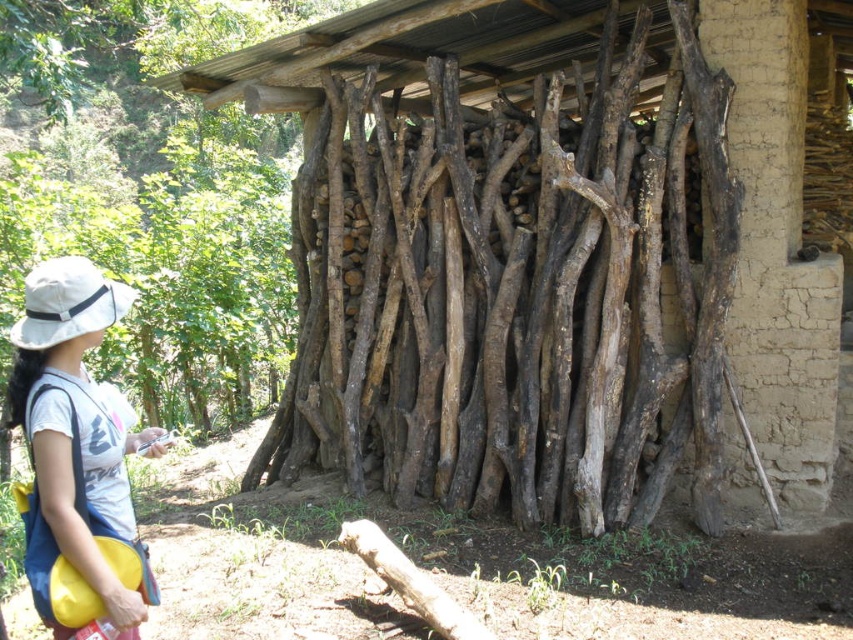
Which is behind, point (421, 465) or point (90, 548)?

Point (421, 465)

Based on the photo, can you confirm if brown rough wood at center is positioned to the right of white fabric hat at left?

Indeed, brown rough wood at center is positioned on the right side of white fabric hat at left.

Between point (604, 200) and point (161, 433), which one is positioned behind?

The point (604, 200) is behind.

Locate an element on the screen. Image resolution: width=853 pixels, height=640 pixels. brown rough wood at center is located at coordinates (512, 292).